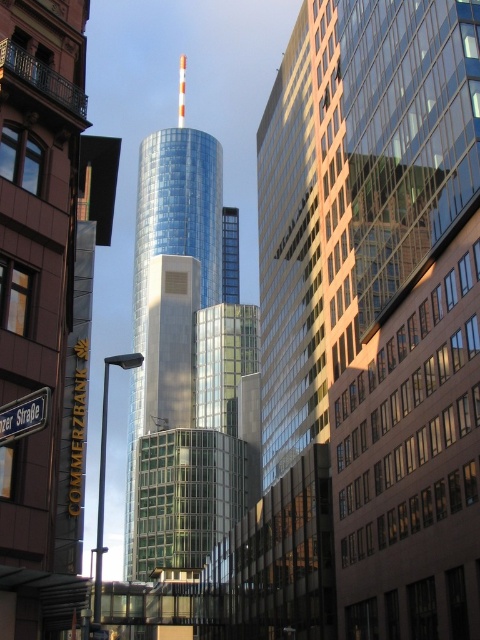
Which is above, shiny glass tower at center or black metal street sign at lower left?

Positioned higher is shiny glass tower at center.

How distant is shiny glass tower at center from black metal street sign at lower left?

shiny glass tower at center and black metal street sign at lower left are 472.86 feet apart from each other.

Does point (180, 474) come farther from viewer compared to point (15, 417)?

Yes, point (180, 474) is behind point (15, 417).

At what (x,y) coordinates should I click in order to perform the action: click on shiny glass tower at center. Please return your answer as a coordinate pair (x, y). This screenshot has width=480, height=640. Looking at the image, I should click on (187, 358).